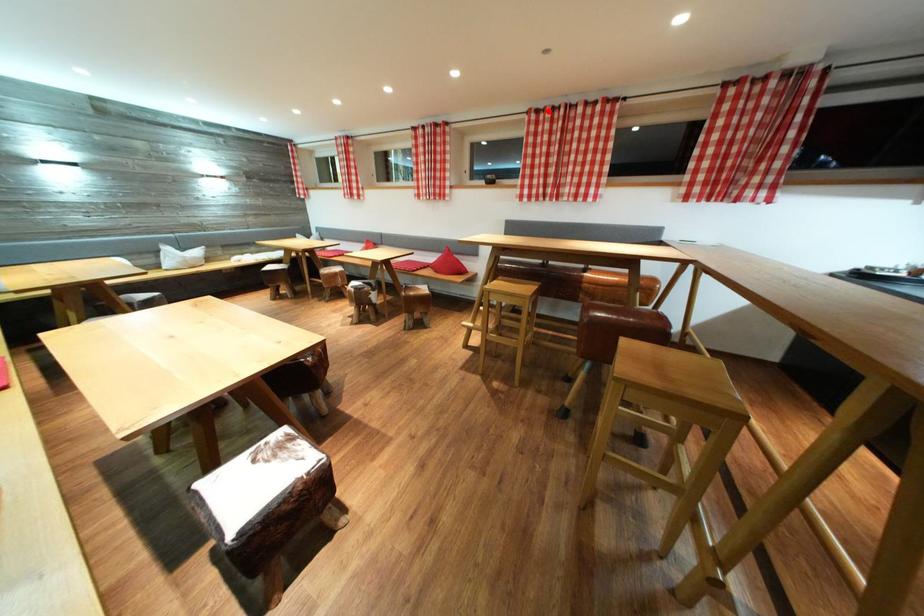
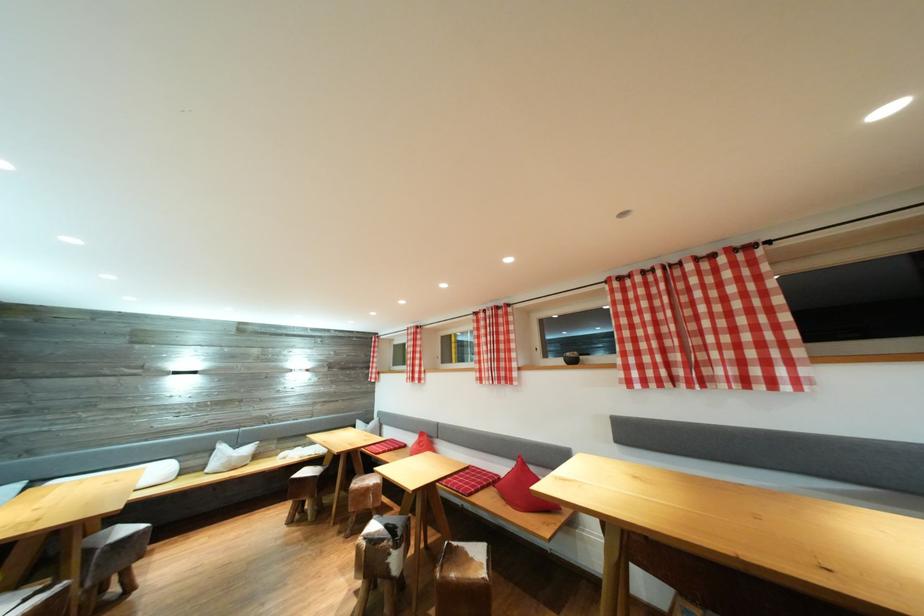
Where in the second image is the point corresponding to the highlighted location from the first image?

(631, 278)